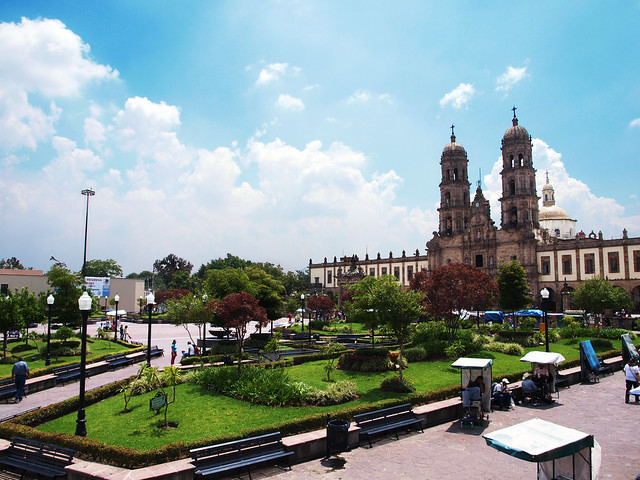
You are a GUI agent. You are given a task and a screenshot of the screen. Output one action in this format:
    pyautogui.click(x=<x>, y=<y>)
    Task: Click on the bench
    
    Given the screenshot: What is the action you would take?
    pyautogui.click(x=38, y=463)